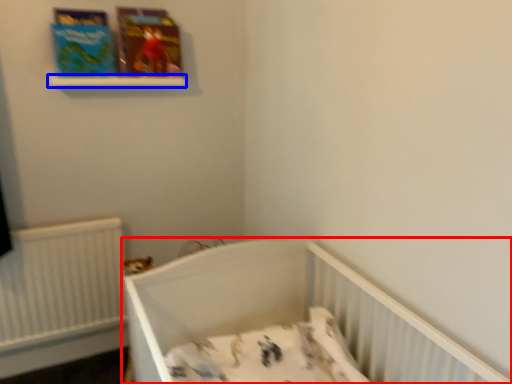
Question: Which of the following is the farthest to the observer, infant bed (highlighted by a red box) or balustrade (highlighted by a blue box)?

Choices:
 (A) infant bed
 (B) balustrade

Answer: (B)